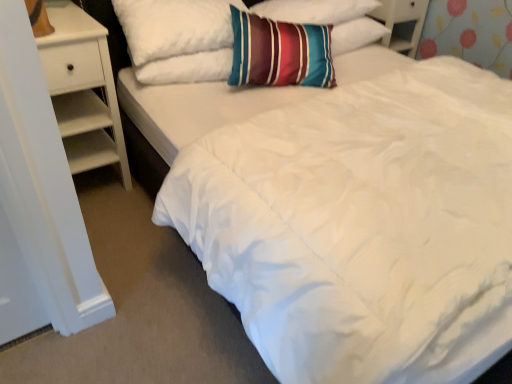
Question: In the image, is white wood nightstand at left positioned in front of or behind striped fabric pillow at upper center, which is the 1th pillow from left to right?

Choices:
 (A) behind
 (B) front

Answer: (B)

Question: Is white wood nightstand at left inside the boundaries of striped fabric pillow at upper center, which is the 1th pillow from left to right, or outside?

Choices:
 (A) outside
 (B) inside

Answer: (A)

Question: Which object is the closest to the striped fabric pillow at upper center, which is the 1th pillow from left to right?

Choices:
 (A) white wood nightstand at left
 (B) striped cotton pillow at center, positioned as the second pillow in left-to-right order
 (C) white wood dresser at upper right

Answer: (B)

Question: Considering the real-world distances, which object is farthest from the white wood nightstand at left?

Choices:
 (A) white wood dresser at upper right
 (B) striped cotton pillow at center, the 1th pillow in the right-to-left sequence
 (C) striped fabric pillow at upper center, which is the 1th pillow from left to right

Answer: (A)